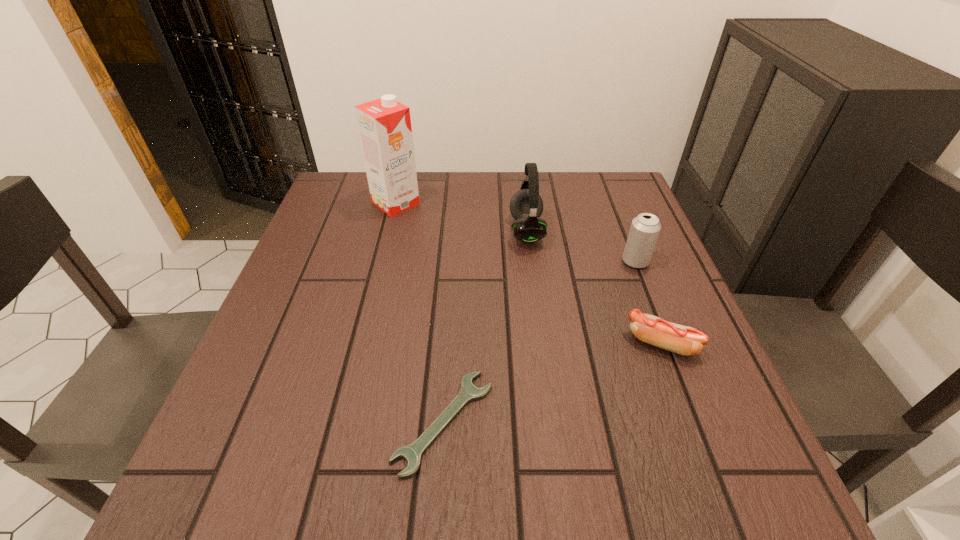
At what (x,y) coordinates should I click in order to perform the action: click on object located at the left edge. Please return your answer as a coordinate pair (x, y). The width and height of the screenshot is (960, 540). Looking at the image, I should click on point(384,125).

Identify the location of beer can present at the right edge. The width and height of the screenshot is (960, 540). (645, 228).

Locate an element on the screen. The width and height of the screenshot is (960, 540). sausage located in the right edge section of the desktop is located at coordinates (683, 340).

Image resolution: width=960 pixels, height=540 pixels. What are the coordinates of `object at the far left corner` in the screenshot? It's located at (x=384, y=125).

Image resolution: width=960 pixels, height=540 pixels. Identify the location of vacant position at the far edge of the desktop. (562, 200).

Locate an element on the screen. The height and width of the screenshot is (540, 960). vacant space at the near edge of the desktop is located at coordinates (487, 488).

Where is `blank space at the left edge of the desktop`? This screenshot has width=960, height=540. blank space at the left edge of the desktop is located at coordinates (267, 412).

Where is `free location at the right edge of the desktop`? This screenshot has width=960, height=540. free location at the right edge of the desktop is located at coordinates (642, 409).

Identify the location of free space at the far left corner of the desktop. (364, 173).

Locate an element on the screen. This screenshot has width=960, height=540. vacant space at the far right corner is located at coordinates (629, 180).